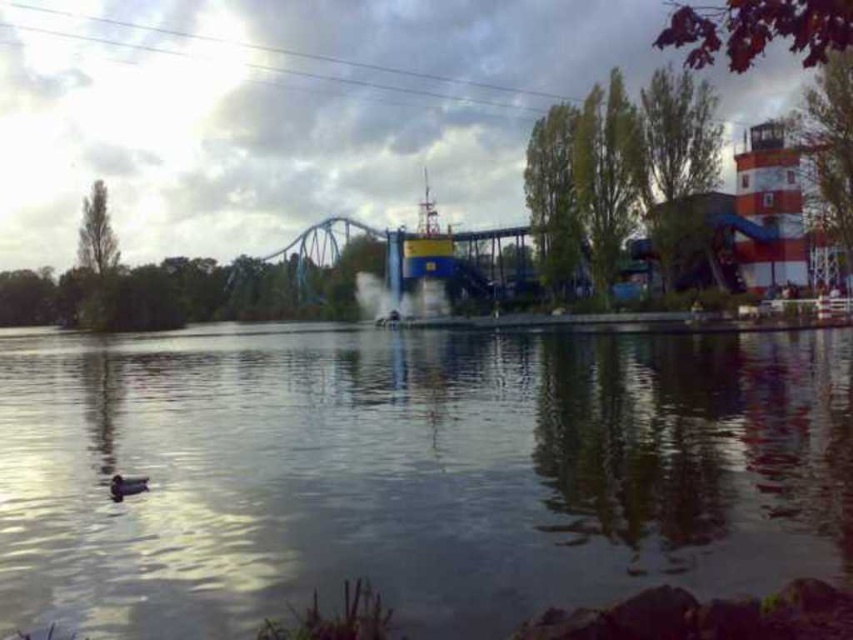
Question: Where is smooth water at center located in relation to brown matte duck at lower left in the image?

Choices:
 (A) right
 (B) left

Answer: (A)

Question: Which object appears farthest from the camera in this image?

Choices:
 (A) smooth water at center
 (B) brown matte duck at lower left

Answer: (B)

Question: Is smooth water at center positioned behind brown matte duck at lower left?

Choices:
 (A) yes
 (B) no

Answer: (B)

Question: Which of the following is the farthest from the observer?

Choices:
 (A) (126, 480)
 (B) (664, 490)

Answer: (A)

Question: Is smooth water at center to the right of brown matte duck at lower left from the viewer's perspective?

Choices:
 (A) yes
 (B) no

Answer: (A)